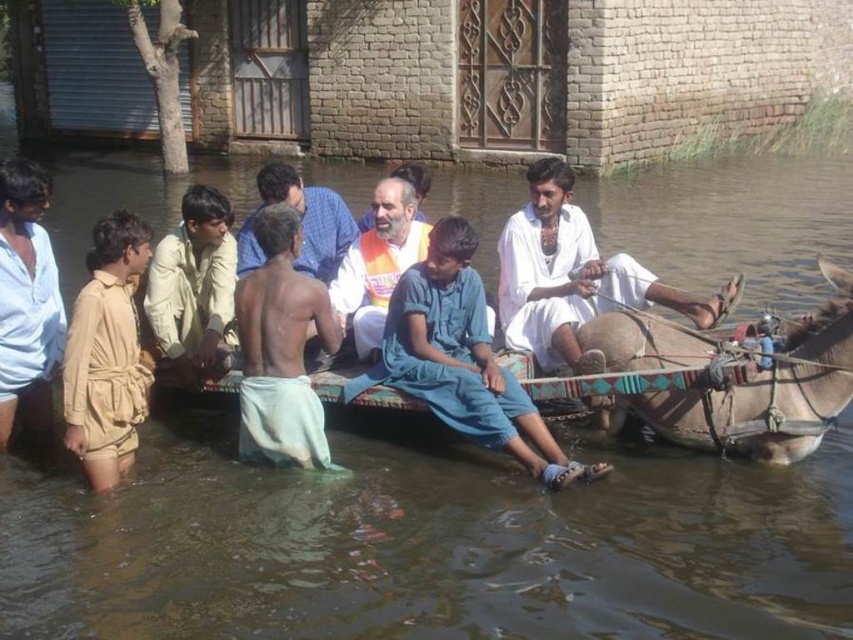
Question: Which point appears closest to the camera in this image?

Choices:
 (A) (91, 310)
 (B) (329, 230)

Answer: (A)

Question: Can you confirm if light beige cotton shirt at center is positioned to the left of orange fabric shirt at center?

Choices:
 (A) yes
 (B) no

Answer: (A)

Question: Based on their relative distances, which object is nearer to the shiny white cloth at center?

Choices:
 (A) white cotton shirt at center
 (B) brown rough hide mule at right

Answer: (A)

Question: Based on their relative distances, which object is nearer to the white cotton shirt at center?

Choices:
 (A) orange fabric shirt at center
 (B) white cotton man at center
 (C) brown rough hide mule at right

Answer: (B)

Question: Does brown rough hide mule at right have a lesser width compared to blue cotton dress at center?

Choices:
 (A) no
 (B) yes

Answer: (B)

Question: Is shiny white cloth at center to the left of light beige cotton shirt at center from the viewer's perspective?

Choices:
 (A) no
 (B) yes

Answer: (A)